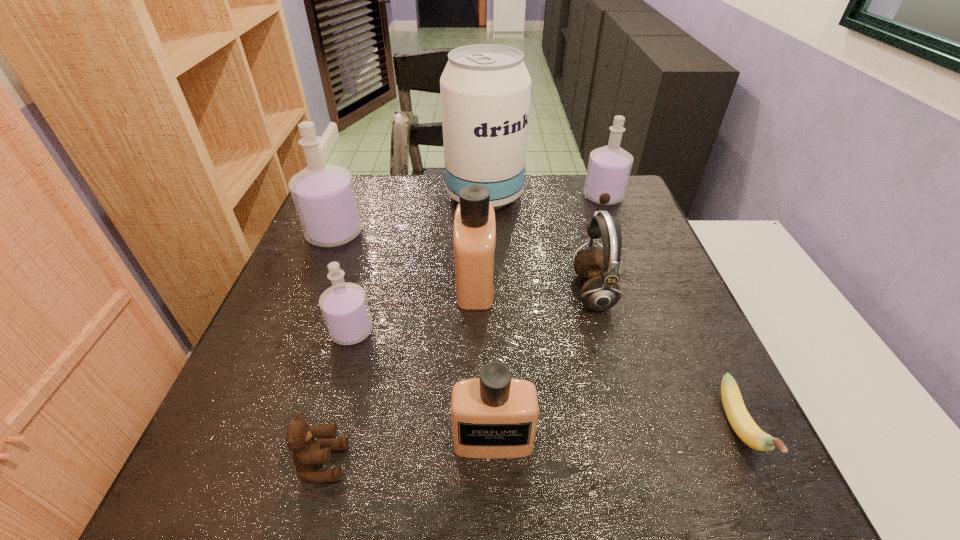
Where is `alcohol`? The height and width of the screenshot is (540, 960). alcohol is located at coordinates (485, 89).

The height and width of the screenshot is (540, 960). Identify the location of the second nearest purple perfume. (324, 197).

The image size is (960, 540). Identify the location of the tallest perfume. (324, 197).

Locate an element on the screen. The image size is (960, 540). the farthest purple perfume is located at coordinates (609, 167).

The height and width of the screenshot is (540, 960). What are the coordinates of `the second biggest purple perfume` in the screenshot? It's located at (609, 167).

Locate an element on the screen. This screenshot has width=960, height=540. the bigger beige perfume is located at coordinates point(474,237).

Locate an element on the screen. The image size is (960, 540). the third farthest perfume is located at coordinates click(x=474, y=237).

Where is `brown earphone`? This screenshot has width=960, height=540. brown earphone is located at coordinates (601, 292).

Locate an element on the screen. The width and height of the screenshot is (960, 540). the seventh object from left to right is located at coordinates (601, 292).

The height and width of the screenshot is (540, 960). Identify the location of the fourth perfume from right to left. (344, 306).